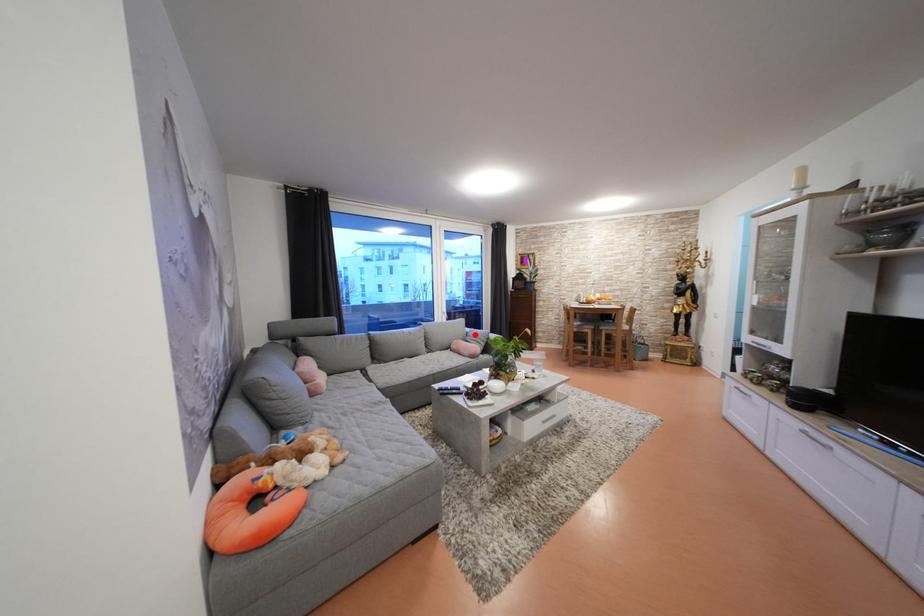
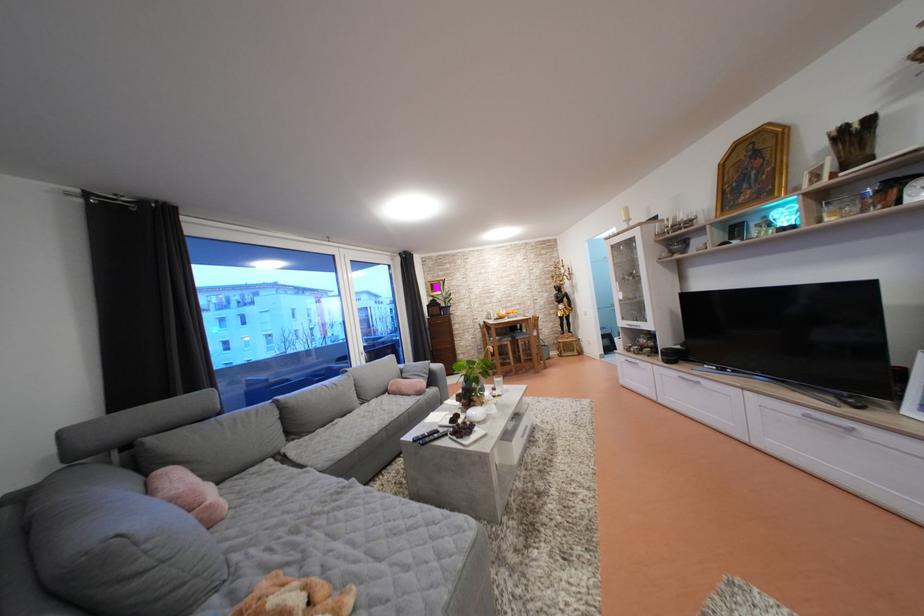
Where in the second image is the point corresponding to the highlighted location from the first image?

(408, 371)